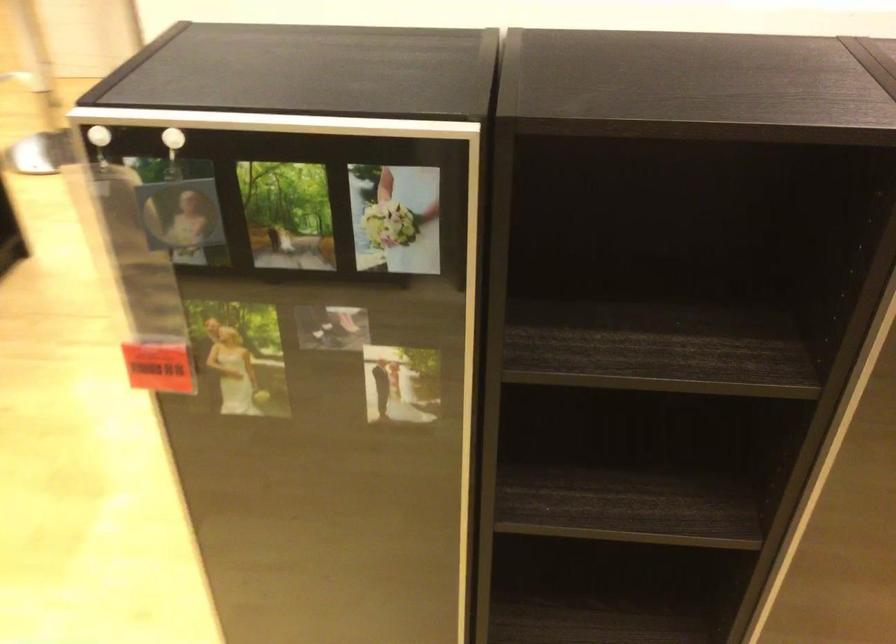
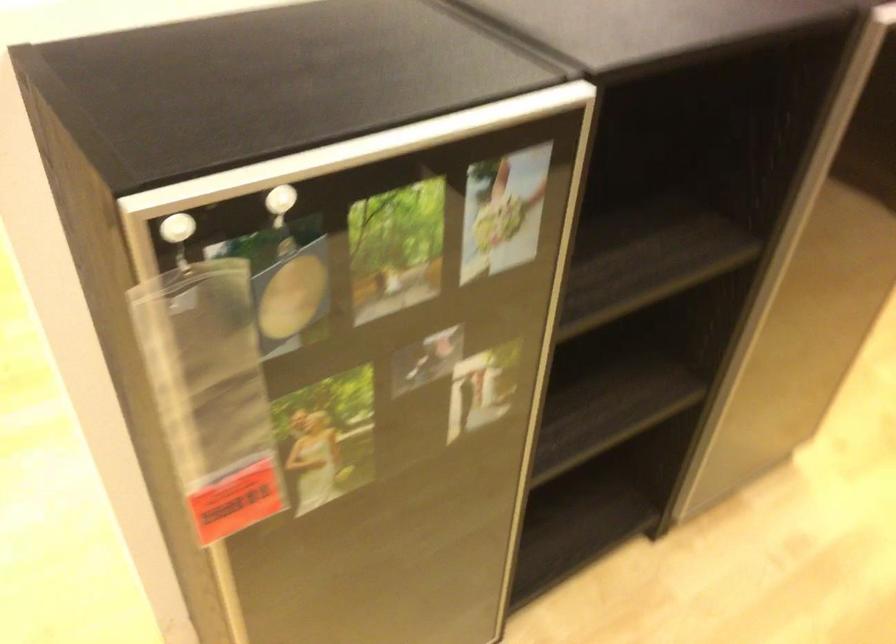
Question: Based on the continuous images, in which direction is the camera rotating? Reply with the corresponding letter.

Choices:
 (A) Left
 (B) Right
 (C) Up
 (D) Down

Answer: (B)